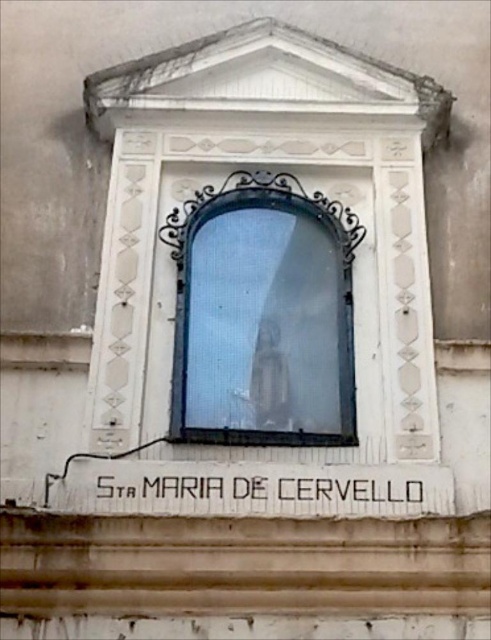
Who is shorter, clear glass statue at center or black painted wood sign at center?

Standing shorter between the two is clear glass statue at center.

Which is more to the left, clear glass statue at center or black painted wood sign at center?

From the viewer's perspective, clear glass statue at center appears more on the left side.

The image size is (491, 640). Describe the element at coordinates (263, 314) in the screenshot. I see `clear glass statue at center` at that location.

You are a GUI agent. You are given a task and a screenshot of the screen. Output one action in this format:
    pyautogui.click(x=<x>, y=<y>)
    Task: Click on the clear glass statue at center
    The image size is (491, 640).
    Given the screenshot: What is the action you would take?
    pyautogui.click(x=263, y=314)